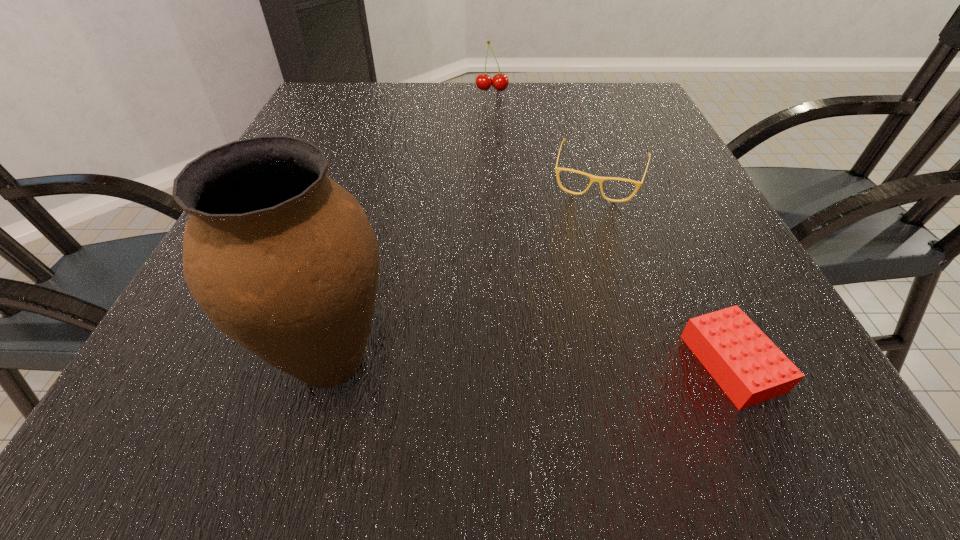
The height and width of the screenshot is (540, 960). In order to click on free space that satisfies the following two spatial constraints: 1. on the front side of the third nearest object; 2. on the left side of the cherry in this screenshot , I will do `click(496, 177)`.

The width and height of the screenshot is (960, 540). In order to click on vacant space that satisfies the following two spatial constraints: 1. on the front side of the farthest object; 2. on the right side of the Lego in this screenshot , I will do `click(504, 363)`.

Image resolution: width=960 pixels, height=540 pixels. What are the coordinates of `vacant region that satisfies the following two spatial constraints: 1. on the front side of the second farthest object; 2. on the left side of the Lego` in the screenshot? It's located at (662, 363).